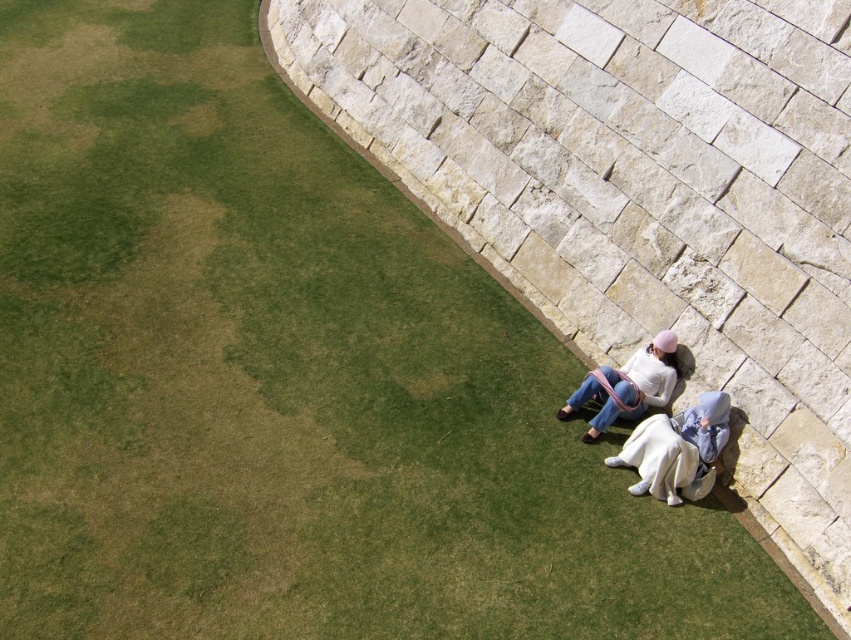
Is white cotton dress at lower right to the left of white cotton sweater at lower right from the viewer's perspective?

No, white cotton dress at lower right is not to the left of white cotton sweater at lower right.

Who is more distant from viewer, (x=663, y=419) or (x=601, y=401)?

The point (x=601, y=401) is behind.

This screenshot has height=640, width=851. I want to click on white cotton dress at lower right, so click(x=677, y=449).